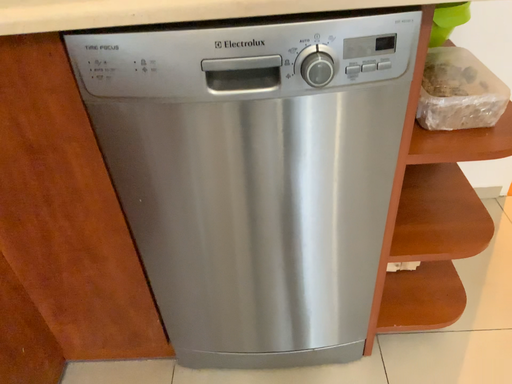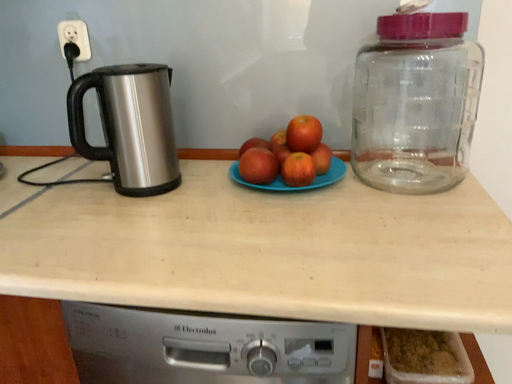
Question: Which way did the camera rotate in the video?

Choices:
 (A) rotated downward
 (B) rotated upward

Answer: (B)